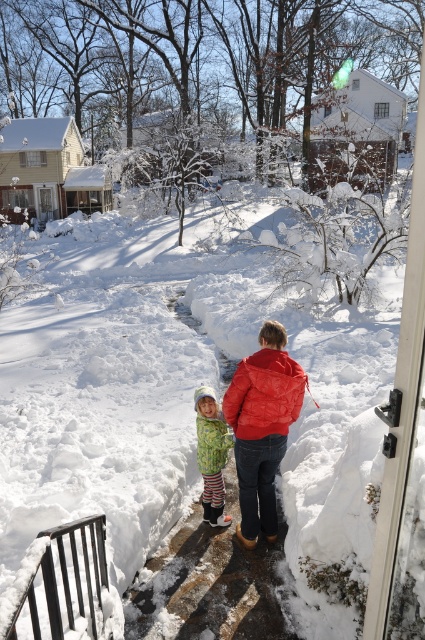
Question: Can you confirm if smooth concrete path at center is thinner than red quilted jacket at center?

Choices:
 (A) no
 (B) yes

Answer: (A)

Question: Which point appears farthest from the camera in this image?

Choices:
 (A) (212, 563)
 (B) (204, 458)
 (C) (260, 401)

Answer: (B)

Question: Does smooth concrete path at center have a smaller size compared to green textured jacket at lower center?

Choices:
 (A) no
 (B) yes

Answer: (A)

Question: Which object appears closest to the camera in this image?

Choices:
 (A) matte red puffer jacket at center
 (B) smooth concrete path at center
 (C) red quilted jacket at center
 (D) fluffy green snowsuit at lower center

Answer: (B)

Question: Which point is closer to the camera taking this photo?

Choices:
 (A) (217, 468)
 (B) (260, 362)

Answer: (B)

Question: Is fluffy green snowsuit at lower center thinner than green textured jacket at lower center?

Choices:
 (A) no
 (B) yes

Answer: (A)